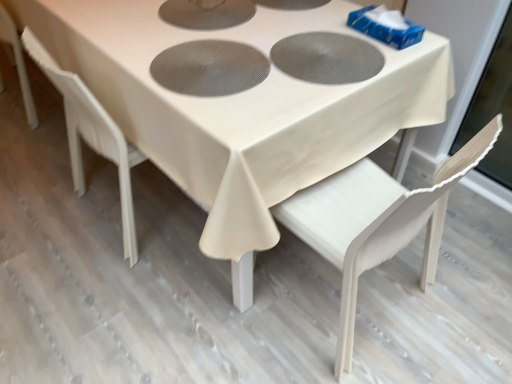
At what (x,y) coordinates should I click in order to perform the action: click on vacant space to the right of white matte chair at lower right, acting as the second chair starting from the left. Please return your answer as a coordinate pair (x, y). Image resolution: width=512 pixels, height=384 pixels. Looking at the image, I should click on (463, 289).